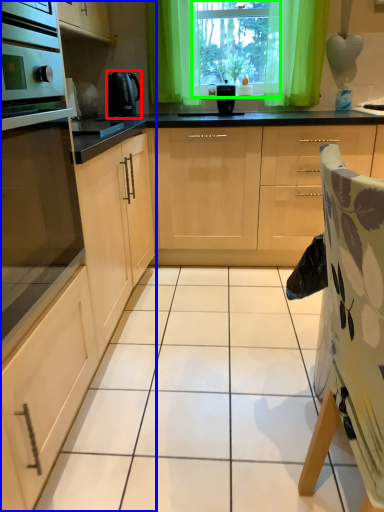
Question: Estimate the real-world distances between objects in this image. Which object is farther from kitchen appliance (highlighted by a red box), cabinetry (highlighted by a blue box) or window screen (highlighted by a green box)?

Choices:
 (A) cabinetry
 (B) window screen

Answer: (A)